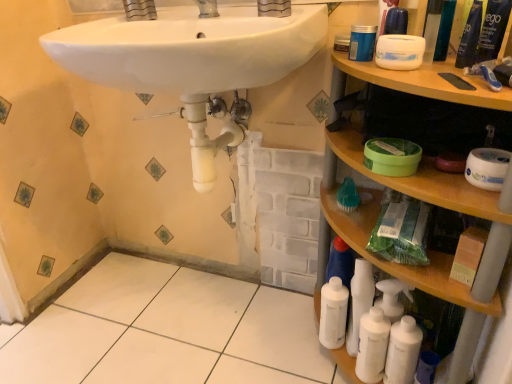
The width and height of the screenshot is (512, 384). Find the location of `vacant space in white glossy sink at upper center (from a real-world perspective)`. vacant space in white glossy sink at upper center (from a real-world perspective) is located at coordinates (203, 324).